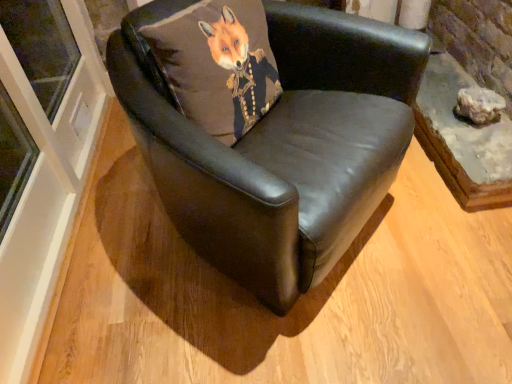
At what (x,y) coordinates should I click in order to perform the action: click on matte brown cushion at center. Please return your answer as a coordinate pair (x, y). Image resolution: width=512 pixels, height=384 pixels. Looking at the image, I should click on (217, 64).

This screenshot has width=512, height=384. I want to click on matte gray rock at right, so click(x=479, y=105).

What are the coordinates of `black leather chair at center` in the screenshot? It's located at (281, 145).

The height and width of the screenshot is (384, 512). I want to click on matte brown cushion at center, so click(x=217, y=64).

Based on the photo, is matte gray rock at right directly adjacent to matte brown cushion at center?

No, matte gray rock at right is not in contact with matte brown cushion at center.

Is matte gray rock at right oriented towards matte brown cushion at center?

No.

From the image's perspective, is matte gray rock at right located above or below matte brown cushion at center?

Based on their image positions, matte gray rock at right is located beneath matte brown cushion at center.

Can you tell me how much matte brown cushion at center and black leather chair at center differ in facing direction?

0.000895 degrees.

Is matte brown cushion at center aimed at black leather chair at center?

Yes, matte brown cushion at center is facing black leather chair at center.

Considering the points (256, 72) and (326, 32), which point is behind, point (256, 72) or point (326, 32)?

The point (326, 32) is more distant.

From the image's perspective, which one is positioned lower, matte brown cushion at center or black leather chair at center?

black leather chair at center, from the image's perspective.

How distant is black leather chair at center from matte gray rock at right?

A distance of 33.05 inches exists between black leather chair at center and matte gray rock at right.

Looking at this image, would you say black leather chair at center is outside matte gray rock at right?

Yes, black leather chair at center is located beyond the bounds of matte gray rock at right.

From the picture: In terms of size, does black leather chair at center appear bigger or smaller than matte gray rock at right?

black leather chair at center is bigger than matte gray rock at right.

From the image's perspective, which is above, black leather chair at center or matte gray rock at right?

From the image's view, matte gray rock at right is above.

Is matte gray rock at right not within black leather chair at center?

Yes, matte gray rock at right is not within black leather chair at center.

From the picture: Which is more to the right, matte gray rock at right or black leather chair at center?

From the viewer's perspective, matte gray rock at right appears more on the right side.

Which of these two, matte gray rock at right or black leather chair at center, stands taller?

black leather chair at center.

In the image, is matte gray rock at right positioned in front of or behind black leather chair at center?

matte gray rock at right is positioned farther from the viewer than black leather chair at center.

This screenshot has height=384, width=512. In order to click on stone below the matte brown cushion at center (from a real-world perspective) in this screenshot , I will do `click(479, 105)`.

Is matte brown cushion at center not near matte gray rock at right?

matte brown cushion at center is near matte gray rock at right, not far away.

Is matte brown cushion at center shorter than matte gray rock at right?

No, matte brown cushion at center is not shorter than matte gray rock at right.

Is matte gray rock at right completely or partially inside matte brown cushion at center?

That's incorrect, matte gray rock at right is not inside matte brown cushion at center.

Visually, is black leather chair at center positioned to the left or to the right of matte brown cushion at center?

From the image, it's evident that black leather chair at center is to the right of matte brown cushion at center.

In the scene shown: Considering the sizes of objects black leather chair at center and matte brown cushion at center in the image provided, who is wider, black leather chair at center or matte brown cushion at center?

black leather chair at center.

Is point (362, 88) behind point (201, 82)?

Yes, point (362, 88) is farther from viewer.

Is black leather chair at center next to matte brown cushion at center and touching it?

No, black leather chair at center is not with matte brown cushion at center.

Locate an element on the screen. The height and width of the screenshot is (384, 512). stone that is on the right side of matte brown cushion at center is located at coordinates (479, 105).

Where is `pillow on the left of black leather chair at center`? The height and width of the screenshot is (384, 512). pillow on the left of black leather chair at center is located at coordinates (217, 64).

When comparing their distances from matte gray rock at right, does matte brown cushion at center or black leather chair at center seem further?

matte brown cushion at center is positioned further to the anchor matte gray rock at right.

Which object lies further to the anchor point black leather chair at center, matte brown cushion at center or matte gray rock at right?

matte gray rock at right.

Looking at the image, which one is located further to matte gray rock at right, black leather chair at center or matte brown cushion at center?

matte brown cushion at center is further to matte gray rock at right.

When comparing their distances from matte brown cushion at center, does matte gray rock at right or black leather chair at center seem closer?

black leather chair at center.

From the image, which object appears to be farther from black leather chair at center, matte gray rock at right or matte brown cushion at center?

matte gray rock at right is further to black leather chair at center.

Which object lies nearer to the anchor point matte brown cushion at center, black leather chair at center or matte gray rock at right?

black leather chair at center.

I want to click on chair between matte brown cushion at center and matte gray rock at right from left to right, so click(x=281, y=145).